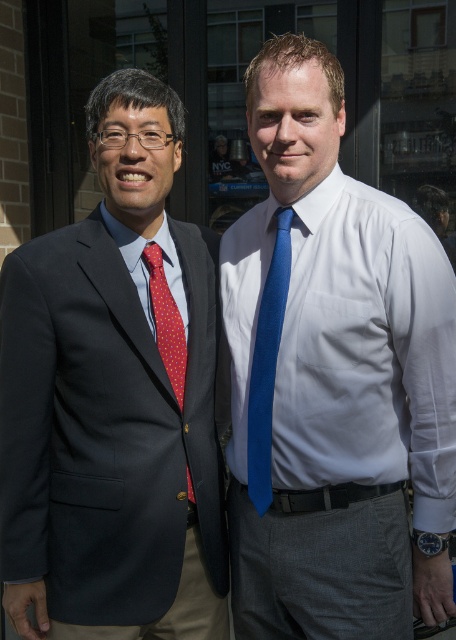
You are a tailor who needs to determine which tie requires more fabric for a custom order. Based on the image, which tie between the blue smooth tie at center and the red dotted fabric tie at left would need more fabric?

The blue smooth tie at center requires more fabric because it has a larger size compared to the red dotted fabric tie at left.

You are a fashion designer observing two people in the image. The person on the left is wearing a matte black suit at left and a red dotted fabric tie at left. You need to determine which item is bigger in size between the two. Which one is larger?

The matte black suit at left is larger in size compared to the red dotted fabric tie at left according to the description.

You are a fashion designer who needs to locate the blue smooth tie at center in the image. What are the coordinates where it is located?

The blue smooth tie at center is located at coordinates point (332, 380).